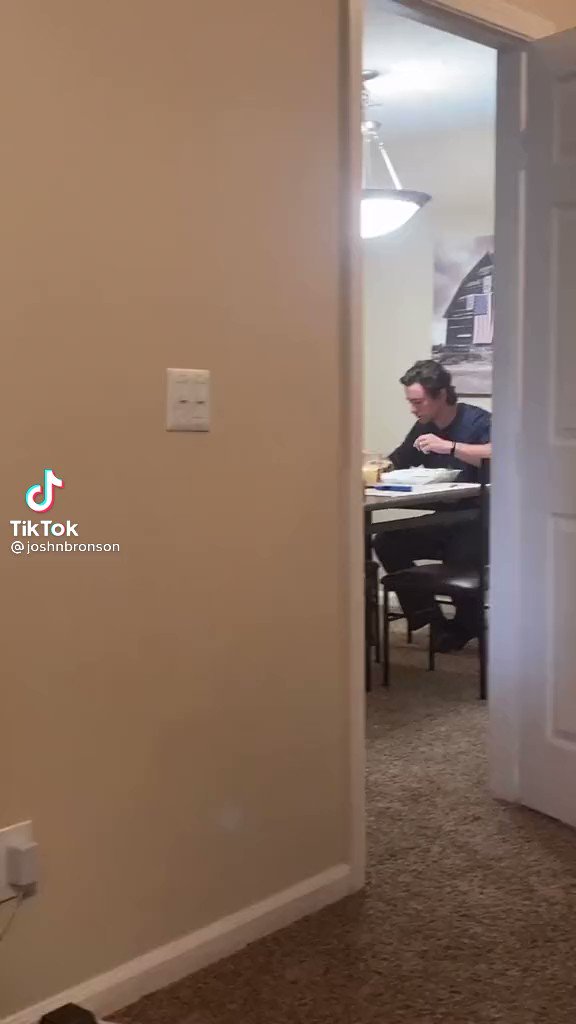
Locate an element on the screen. The width and height of the screenshot is (576, 1024). chair is located at coordinates (453, 579).